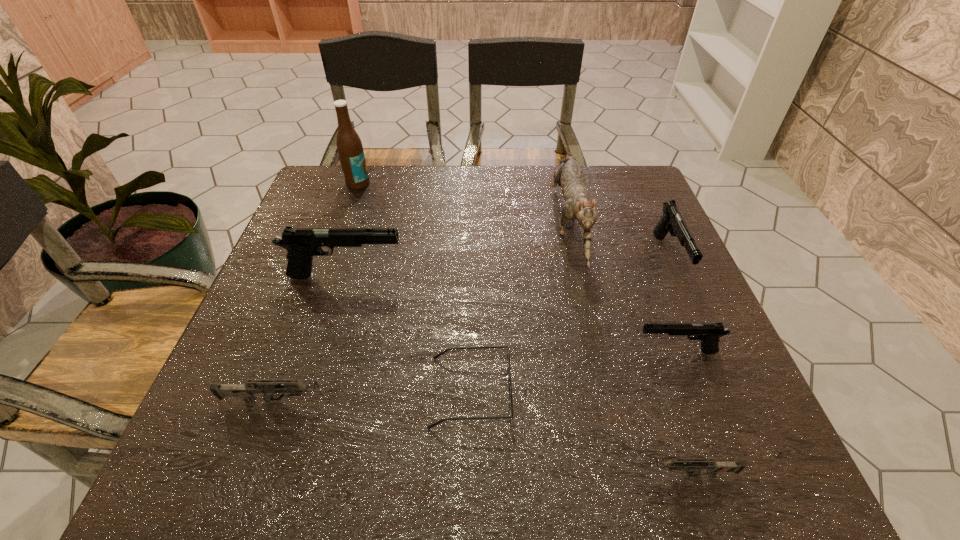
I want to click on beer bottle, so click(x=350, y=150).

You are a GUI agent. You are given a task and a screenshot of the screen. Output one action in this format:
    pyautogui.click(x=<x>, y=<y>)
    Task: Click on the cat
    The height and width of the screenshot is (540, 960).
    Given the screenshot: What is the action you would take?
    pyautogui.click(x=569, y=176)

What are the coordinates of `the leftmost black gun` in the screenshot? It's located at (302, 244).

Identify the location of the tallest gun. This screenshot has width=960, height=540. point(302,244).

I want to click on the fifth shortest object, so click(x=672, y=221).

Identify the location of the second tallest gun. [x=672, y=221].

Find the location of a particular element. the third tallest gun is located at coordinates [709, 333].

You are a GUI agent. You are given a task and a screenshot of the screen. Output one action in this format:
    pyautogui.click(x=<x>, y=<y>)
    Task: Click on the third farthest gun
    The width and height of the screenshot is (960, 540).
    Given the screenshot: What is the action you would take?
    pyautogui.click(x=709, y=333)

I want to click on the fourth tallest gun, so pos(288,388).

The width and height of the screenshot is (960, 540). What are the coordinates of `the farther grey gun` in the screenshot? It's located at (288, 388).